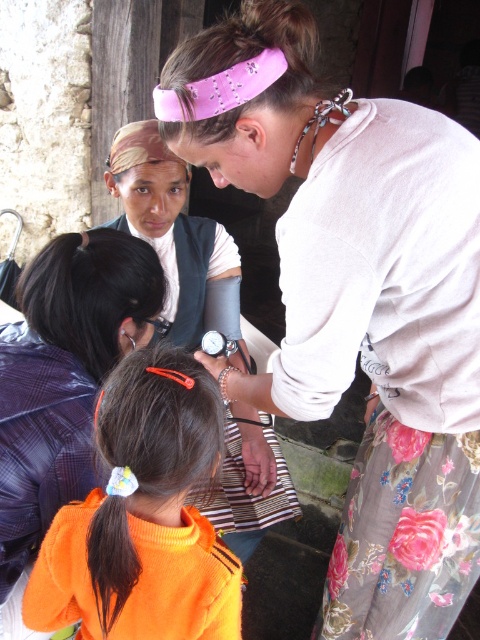
You are standing in the outdoor medical checkup scene. There is a point at coordinates point (x=435, y=358). Can you tell me how far this point is from you?

The point (x=435, y=358) is 37.59 inches from the viewer.

You are a photographer trying to capture a clear shot of both the pink fabric headband at upper center and the orange fabric hair tie at center. Based on their positions, which object is closer to the camera?

The orange fabric hair tie at center is behind the pink fabric headband at upper center, so the pink fabric headband at upper center is closer to the camera.